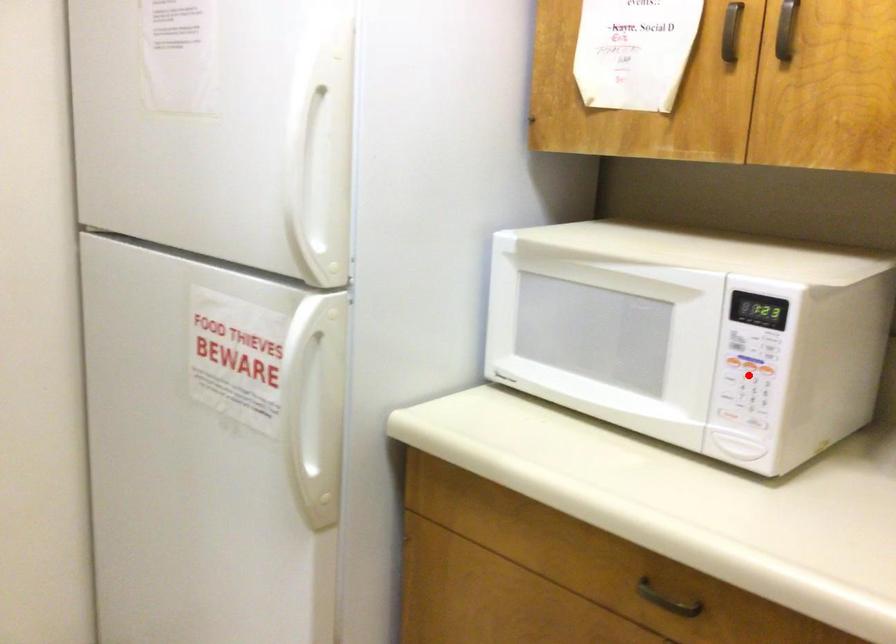
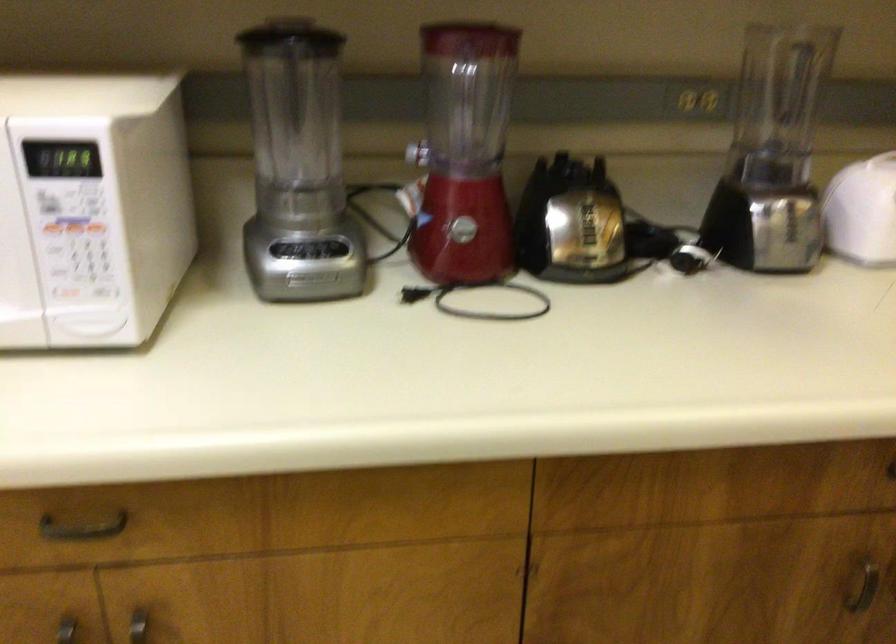
Question: I am providing you with two images of the same scene from different viewpoints. Given a red point in image1, look at the same physical point in image2. Is it:

Choices:
 (A) Closer to the viewpoint
 (B) Farther from the viewpoint

Answer: (A)